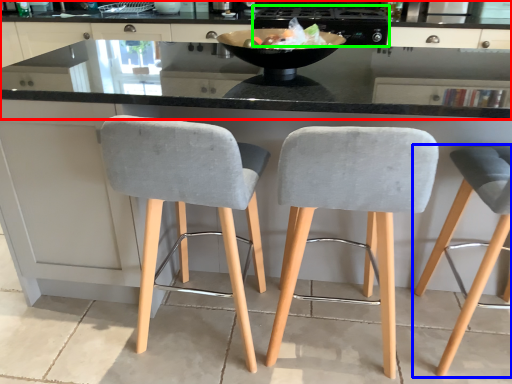
Question: Estimate the real-world distances between objects in this image. Which object is farther from cabinetry (highlighted by a red box), chair (highlighted by a blue box) or appliance (highlighted by a green box)?

Choices:
 (A) chair
 (B) appliance

Answer: (A)